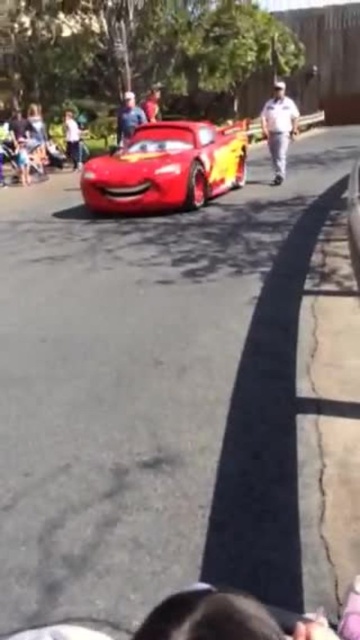
You are standing at the center of the paved road where the red race car with yellow lightning bolt designs is moving forward. There are two points marked on the road ahead of you. Which point is closer to you, point (267,132) or point (149,96)?

Point (267,132) is closer to the viewer than point (149,96).

You are a photographer trying to capture a clear shot of the white uniform at center and the matte red shirt at upper center. However, you want to ensure that neither of them is blocking the other in your photo. Based on their positions, can you take a photo where both are visible without one being in front of the other?

The white uniform at center is in front of the matte red shirt at upper center, so the white uniform at center would block the matte red shirt at upper center in the photo. To capture both without obstruction, you would need to adjust your angle or position to ensure neither is directly in front of the other.